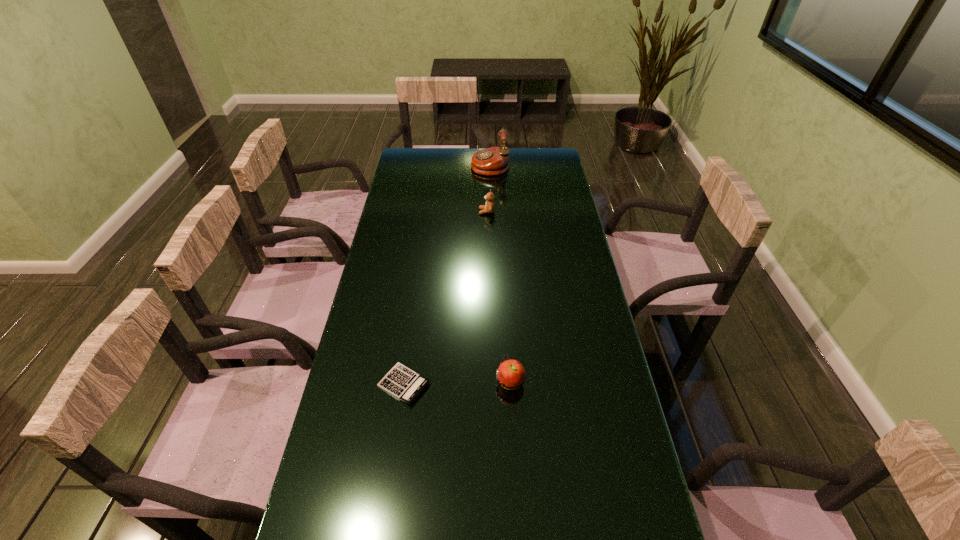
Image resolution: width=960 pixels, height=540 pixels. Identify the location of vacant space situated on the front-facing side of the teddy bear. (400, 212).

You are a GUI agent. You are given a task and a screenshot of the screen. Output one action in this format:
    pyautogui.click(x=<x>, y=<y>)
    Task: Click on the vacant space located on the front-facing side of the teddy bear
    
    Given the screenshot: What is the action you would take?
    pyautogui.click(x=454, y=212)

Where is `free space located 0.120m on the back of the apple`? Image resolution: width=960 pixels, height=540 pixels. free space located 0.120m on the back of the apple is located at coordinates (508, 335).

This screenshot has width=960, height=540. Find the location of `vacant space situated on the right of the leftmost object`. vacant space situated on the right of the leftmost object is located at coordinates (463, 384).

This screenshot has width=960, height=540. What are the coordinates of `object at the far edge` in the screenshot? It's located at (492, 161).

Where is `object that is positioned at the left edge`? object that is positioned at the left edge is located at coordinates (403, 383).

Where is `free space at the far edge of the desktop`? The image size is (960, 540). free space at the far edge of the desktop is located at coordinates (460, 160).

This screenshot has width=960, height=540. Find the location of `vacant space at the left edge`. vacant space at the left edge is located at coordinates (420, 210).

Identify the location of vacant space at the right edge of the desktop. The width and height of the screenshot is (960, 540). [642, 502].

You are a GUI agent. You are given a task and a screenshot of the screen. Output one action in this format:
    pyautogui.click(x=<x>, y=<y>)
    Task: Click on the vacant space at the far left corner of the desktop
    This screenshot has height=540, width=960.
    Given the screenshot: What is the action you would take?
    pyautogui.click(x=417, y=153)